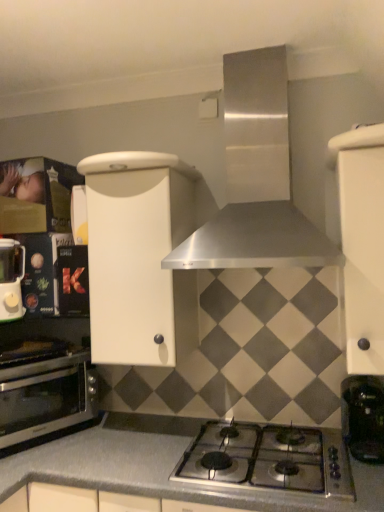
Where is `vacant area situated below white matte cabinet at center, which is counted as the first cabinetry, starting from the left (from a real-world perspective)`? vacant area situated below white matte cabinet at center, which is counted as the first cabinetry, starting from the left (from a real-world perspective) is located at coordinates 141,436.